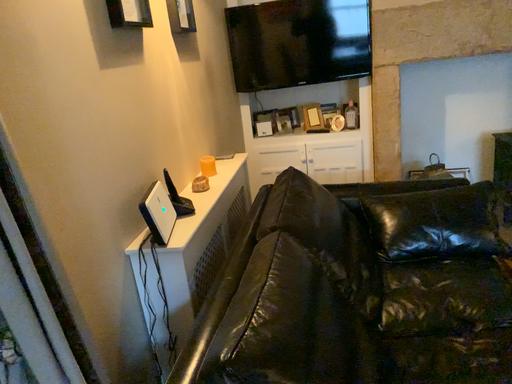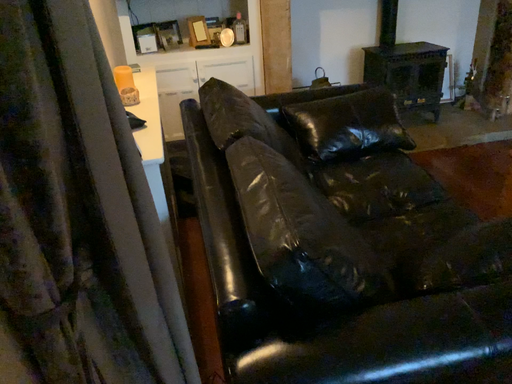
Question: Which way did the camera rotate in the video?

Choices:
 (A) rotated right
 (B) rotated left

Answer: (A)